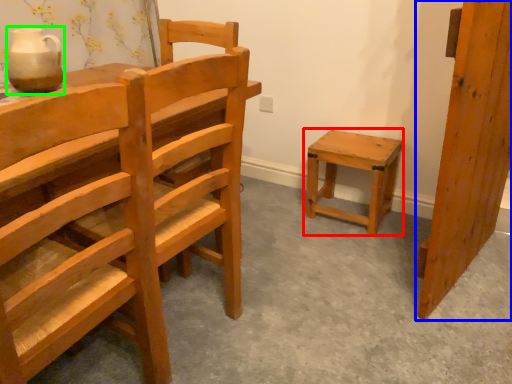
Question: Which object is positioned farthest from stool (highlighted by a red box)? Select from wood (highlighted by a blue box) and pottery (highlighted by a green box).

Choices:
 (A) wood
 (B) pottery

Answer: (B)